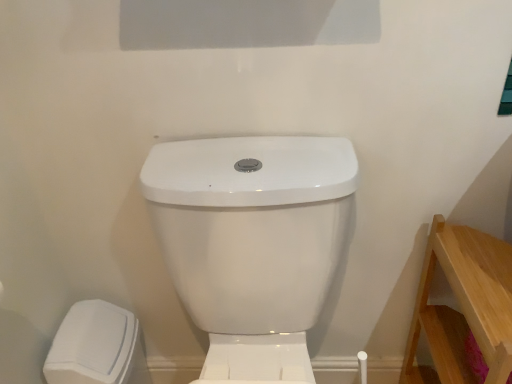
Question: Does white glossy toilet at center lie behind light wood/rough wooden stool at lower right?

Choices:
 (A) no
 (B) yes

Answer: (A)

Question: Does white glossy toilet at center have a lesser width compared to light wood/rough wooden stool at lower right?

Choices:
 (A) yes
 (B) no

Answer: (B)

Question: Can you confirm if white glossy toilet at center is smaller than light wood/rough wooden stool at lower right?

Choices:
 (A) no
 (B) yes

Answer: (A)

Question: Considering the relative sizes of white glossy toilet at center and light wood/rough wooden stool at lower right in the image provided, is white glossy toilet at center shorter than light wood/rough wooden stool at lower right?

Choices:
 (A) no
 (B) yes

Answer: (A)

Question: Are white glossy toilet at center and light wood/rough wooden stool at lower right making contact?

Choices:
 (A) yes
 (B) no

Answer: (B)

Question: From the image's perspective, is white matte trash can at lower left positioned above or below white glossy toilet at center?

Choices:
 (A) above
 (B) below

Answer: (B)

Question: Looking at their shapes, would you say white matte trash can at lower left is wider or thinner than white glossy toilet at center?

Choices:
 (A) thin
 (B) wide

Answer: (A)

Question: From a real-world perspective, is white matte trash can at lower left positioned above or below white glossy toilet at center?

Choices:
 (A) below
 (B) above

Answer: (A)

Question: In terms of size, does white matte trash can at lower left appear bigger or smaller than white glossy toilet at center?

Choices:
 (A) small
 (B) big

Answer: (A)

Question: Considering the positions of white glossy toilet at center and light wood/rough wooden stool at lower right in the image, is white glossy toilet at center bigger or smaller than light wood/rough wooden stool at lower right?

Choices:
 (A) big
 (B) small

Answer: (A)

Question: From a real-world perspective, is white glossy toilet at center above or below light wood/rough wooden stool at lower right?

Choices:
 (A) above
 (B) below

Answer: (A)

Question: Choose the correct answer: Is white glossy toilet at center inside light wood/rough wooden stool at lower right or outside it?

Choices:
 (A) inside
 (B) outside

Answer: (B)

Question: Considering their positions, is white glossy toilet at center located in front of or behind light wood/rough wooden stool at lower right?

Choices:
 (A) behind
 (B) front

Answer: (B)

Question: Relative to light wood/rough wooden stool at lower right, is white matte trash can at lower left in front or behind?

Choices:
 (A) front
 (B) behind

Answer: (B)

Question: Visually, is white matte trash can at lower left positioned to the left or to the right of light wood/rough wooden stool at lower right?

Choices:
 (A) left
 (B) right

Answer: (A)